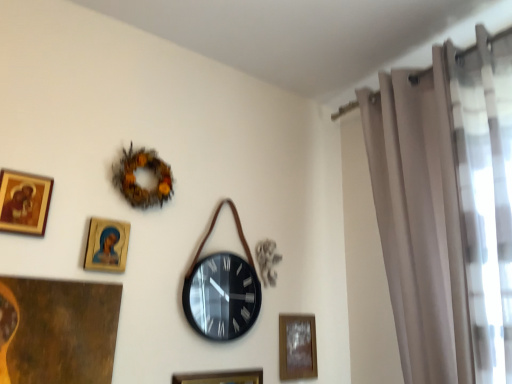
The width and height of the screenshot is (512, 384). Describe the element at coordinates (297, 347) in the screenshot. I see `wooden frame at lower center, which ranks as the 4th picture frame in front-to-back order` at that location.

This screenshot has width=512, height=384. Describe the element at coordinates (24, 202) in the screenshot. I see `gold-framed picture at upper left, placed as the 1th picture frame when sorted from front to back` at that location.

What is the approximate width of wooden picture frame at lower center, positioned as the 3th picture frame in front-to-back order?

0.96 inches.

This screenshot has height=384, width=512. What do you see at coordinates (135, 178) in the screenshot?
I see `brown textured wreath at upper center` at bounding box center [135, 178].

Locate an element on the screen. This screenshot has width=512, height=384. wooden frame at lower center, the 1th picture frame positioned from the back is located at coordinates (297, 347).

Is wooden glossy picture frame at upper left, the 3th picture frame positioned from the back, oriented away from brown textured wreath at upper center?

No, wooden glossy picture frame at upper left, the 3th picture frame positioned from the back, is not facing away from brown textured wreath at upper center.

Considering the positions of objects wooden glossy picture frame at upper left, which is the 2th picture frame from left to right, and brown textured wreath at upper center in the image provided, who is more to the right, wooden glossy picture frame at upper left, which is the 2th picture frame from left to right, or brown textured wreath at upper center?

Positioned to the right is brown textured wreath at upper center.

Is there a large distance between wooden glossy picture frame at upper left, which is the 2th picture frame in top-to-bottom order, and brown textured wreath at upper center?

They are positioned close to each other.

Where is `decor that appears behind the wooden glossy picture frame at upper left, which is the 2th picture frame in top-to-bottom order`? This screenshot has width=512, height=384. decor that appears behind the wooden glossy picture frame at upper left, which is the 2th picture frame in top-to-bottom order is located at coordinates (135, 178).

Considering the positions of objects black matte wall clock at center and wooden glossy picture frame at upper left, which appears as the third picture frame when ordered from the bottom, in the image provided, who is more to the left, black matte wall clock at center or wooden glossy picture frame at upper left, which appears as the third picture frame when ordered from the bottom,?

From the viewer's perspective, wooden glossy picture frame at upper left, which appears as the third picture frame when ordered from the bottom, appears more on the left side.

Which point is more forward, (252, 319) or (110, 260)?

The point (110, 260) is more forward.

Is wooden glossy picture frame at upper left, which is the 2th picture frame in top-to-bottom order, at the back of black matte wall clock at center?

black matte wall clock at center does not have its back to wooden glossy picture frame at upper left, which is the 2th picture frame in top-to-bottom order.

Between black matte wall clock at center and wooden glossy picture frame at upper left, which appears as the third picture frame when ordered from the bottom, which one has smaller size?

wooden glossy picture frame at upper left, which appears as the third picture frame when ordered from the bottom, is smaller.

Which is correct: beige sheer curtain at right is inside wooden frame at lower center, which ranks as the second picture frame in bottom-to-top order, or outside of it?

beige sheer curtain at right is located beyond the bounds of wooden frame at lower center, which ranks as the second picture frame in bottom-to-top order.

From their relative heights in the image, would you say beige sheer curtain at right is taller or shorter than wooden frame at lower center, which ranks as the 3th picture frame in top-to-bottom order?

Considering their sizes, beige sheer curtain at right has more height than wooden frame at lower center, which ranks as the 3th picture frame in top-to-bottom order.

Is beige sheer curtain at right positioned before wooden frame at lower center, which ranks as the 3th picture frame in top-to-bottom order?

Yes, it is.

Considering the points (461, 382) and (290, 374), which point is behind, point (461, 382) or point (290, 374)?

The point (290, 374) is farther.

Does gold-framed picture at upper left, the fourth picture frame in the right-to-left sequence, appear on the left side of wooden frame at lower center, the 1th picture frame when ordered from right to left?

Correct, you'll find gold-framed picture at upper left, the fourth picture frame in the right-to-left sequence, to the left of wooden frame at lower center, the 1th picture frame when ordered from right to left.

Consider the image. Does gold-framed picture at upper left, which is counted as the first picture frame, starting from the top, touch wooden frame at lower center, which ranks as the 4th picture frame in front-to-back order?

No, gold-framed picture at upper left, which is counted as the first picture frame, starting from the top, is not touching wooden frame at lower center, which ranks as the 4th picture frame in front-to-back order.

Is gold-framed picture at upper left, the 4th picture frame positioned from the bottom, inside the boundaries of wooden frame at lower center, the 1th picture frame when ordered from right to left, or outside?

The correct answer is: outside.

Considering the sizes of objects gold-framed picture at upper left, the fourth picture frame in the right-to-left sequence, and wooden frame at lower center, which ranks as the second picture frame in bottom-to-top order, in the image provided, who is smaller, gold-framed picture at upper left, the fourth picture frame in the right-to-left sequence, or wooden frame at lower center, which ranks as the second picture frame in bottom-to-top order,?

gold-framed picture at upper left, the fourth picture frame in the right-to-left sequence, is smaller.

Does black matte wall clock at center appear on the left side of gold-framed picture at upper left, which is counted as the first picture frame, starting from the top?

No, black matte wall clock at center is not to the left of gold-framed picture at upper left, which is counted as the first picture frame, starting from the top.

Which of these two, black matte wall clock at center or gold-framed picture at upper left, placed as the 1th picture frame when sorted from front to back, is wider?

With larger width is black matte wall clock at center.

From the image's perspective, is black matte wall clock at center on top of gold-framed picture at upper left, the 4th picture frame viewed from the back?

Actually, black matte wall clock at center appears below gold-framed picture at upper left, the 4th picture frame viewed from the back, in the image.

Considering the sizes of wooden picture frame at lower center, the 2th picture frame when ordered from right to left, and wooden frame at lower center, the fourth picture frame in the left-to-right sequence, in the image, is wooden picture frame at lower center, the 2th picture frame when ordered from right to left, taller or shorter than wooden frame at lower center, the fourth picture frame in the left-to-right sequence,?

Considering their sizes, wooden picture frame at lower center, the 2th picture frame when ordered from right to left, has more height than wooden frame at lower center, the fourth picture frame in the left-to-right sequence.

How distant is wooden picture frame at lower center, placed as the 2th picture frame when sorted from back to front, from wooden frame at lower center, which ranks as the 4th picture frame in front-to-back order?

A distance of 9.22 inches exists between wooden picture frame at lower center, placed as the 2th picture frame when sorted from back to front, and wooden frame at lower center, which ranks as the 4th picture frame in front-to-back order.

Could you tell me if wooden picture frame at lower center, placed as the 2th picture frame when sorted from back to front, is turned towards wooden frame at lower center, which ranks as the 3th picture frame in top-to-bottom order?

No, wooden picture frame at lower center, placed as the 2th picture frame when sorted from back to front, does not turn towards wooden frame at lower center, which ranks as the 3th picture frame in top-to-bottom order.

From a real-world perspective, between wooden picture frame at lower center, placed as the 2th picture frame when sorted from back to front, and wooden frame at lower center, the 1th picture frame positioned from the back, who is vertically lower?

wooden picture frame at lower center, placed as the 2th picture frame when sorted from back to front, is physically lower.

Is black matte wall clock at center facing away from beige sheer curtain at right?

black matte wall clock at center is not turned away from beige sheer curtain at right.

How much distance is there between black matte wall clock at center and beige sheer curtain at right?

A distance of 27.42 inches exists between black matte wall clock at center and beige sheer curtain at right.

From a real-world perspective, which is physically below, black matte wall clock at center or beige sheer curtain at right?

black matte wall clock at center.

From the image's perspective, starting from the brown textured wreath at upper center, which picture frame is the 2nd one below? Please provide its 2D coordinates.

[(106, 245)]

Where is `wall clock on the right of wooden glossy picture frame at upper left, which is the 2th picture frame in top-to-bottom order`? Image resolution: width=512 pixels, height=384 pixels. wall clock on the right of wooden glossy picture frame at upper left, which is the 2th picture frame in top-to-bottom order is located at coordinates (222, 296).

Estimate the real-world distances between objects in this image. Which object is further from gold-framed picture at upper left, the fourth picture frame in the right-to-left sequence, wooden glossy picture frame at upper left, which is the 2th picture frame in top-to-bottom order, or beige sheer curtain at right?

beige sheer curtain at right lies further to gold-framed picture at upper left, the fourth picture frame in the right-to-left sequence, than the other object.

Considering their positions, is wooden glossy picture frame at upper left, which is the 2th picture frame from left to right, positioned further to wooden picture frame at lower center, positioned as the 3th picture frame in front-to-back order, than gold-framed picture at upper left, placed as the 1th picture frame when sorted from front to back?

Among the two, gold-framed picture at upper left, placed as the 1th picture frame when sorted from front to back, is located further to wooden picture frame at lower center, positioned as the 3th picture frame in front-to-back order.

When comparing their distances from beige sheer curtain at right, does wooden picture frame at lower center, the 3th picture frame when ordered from left to right, or wooden glossy picture frame at upper left, the third picture frame from the right, seem further?

wooden glossy picture frame at upper left, the third picture frame from the right.

Looking at the image, which one is located closer to wooden picture frame at lower center, the 2th picture frame when ordered from right to left, gold-framed picture at upper left, the first picture frame positioned from the left, or black matte wall clock at center?

black matte wall clock at center is positioned closer to the anchor wooden picture frame at lower center, the 2th picture frame when ordered from right to left.

Based on their spatial positions, is beige sheer curtain at right or brown textured wreath at upper center further from black matte wall clock at center?

The object further to black matte wall clock at center is beige sheer curtain at right.

Which object lies further to the anchor point gold-framed picture at upper left, the 4th picture frame positioned from the bottom, wooden picture frame at lower center, the 2th picture frame when ordered from right to left, or beige sheer curtain at right?

Based on the image, beige sheer curtain at right appears to be further to gold-framed picture at upper left, the 4th picture frame positioned from the bottom.

Looking at this image, when comparing their distances from wooden picture frame at lower center, the 2th picture frame when ordered from right to left, does wooden frame at lower center, the 1th picture frame when ordered from right to left, or brown textured wreath at upper center seem closer?

wooden frame at lower center, the 1th picture frame when ordered from right to left, is closer to wooden picture frame at lower center, the 2th picture frame when ordered from right to left.

Which object lies further to the anchor point black matte wall clock at center, wooden picture frame at lower center, the 4th picture frame in the top-to-bottom sequence, or beige sheer curtain at right?

beige sheer curtain at right lies further to black matte wall clock at center than the other object.

The width and height of the screenshot is (512, 384). Identify the location of wall clock between wooden glossy picture frame at upper left, which is the 2th picture frame from left to right, and wooden picture frame at lower center, placed as the 2th picture frame when sorted from back to front, vertically. (222, 296).

This screenshot has height=384, width=512. Find the location of `wall clock that lies between brown textured wreath at upper center and wooden frame at lower center, which ranks as the 4th picture frame in front-to-back order, from top to bottom`. wall clock that lies between brown textured wreath at upper center and wooden frame at lower center, which ranks as the 4th picture frame in front-to-back order, from top to bottom is located at coordinates point(222,296).

Where is `decor between gold-framed picture at upper left, placed as the 1th picture frame when sorted from front to back, and beige sheer curtain at right`? decor between gold-framed picture at upper left, placed as the 1th picture frame when sorted from front to back, and beige sheer curtain at right is located at coordinates (135, 178).

Where is `decor located between wooden glossy picture frame at upper left, which is the 2th picture frame in top-to-bottom order, and wooden frame at lower center, the fourth picture frame in the left-to-right sequence, in the left-right direction`? decor located between wooden glossy picture frame at upper left, which is the 2th picture frame in top-to-bottom order, and wooden frame at lower center, the fourth picture frame in the left-to-right sequence, in the left-right direction is located at coordinates (135, 178).